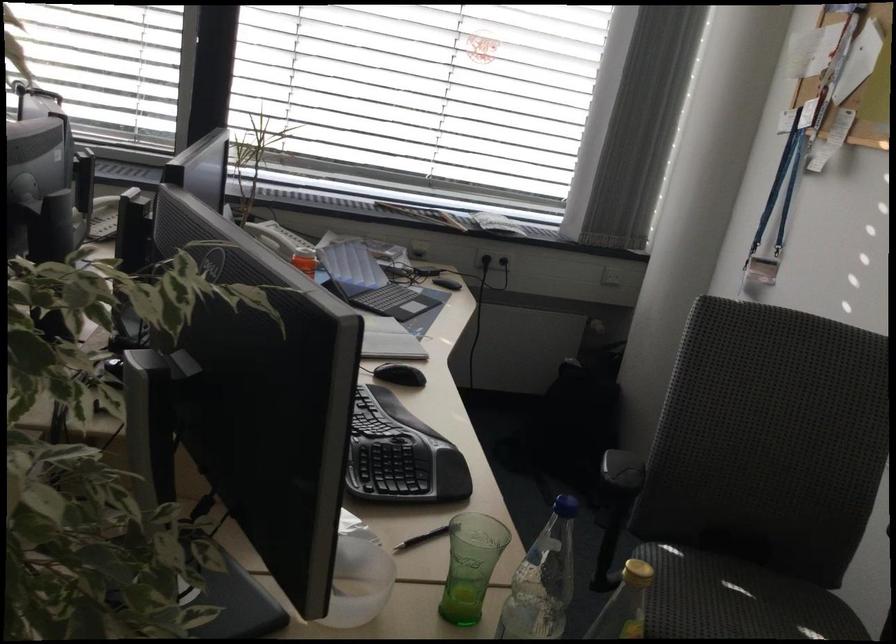
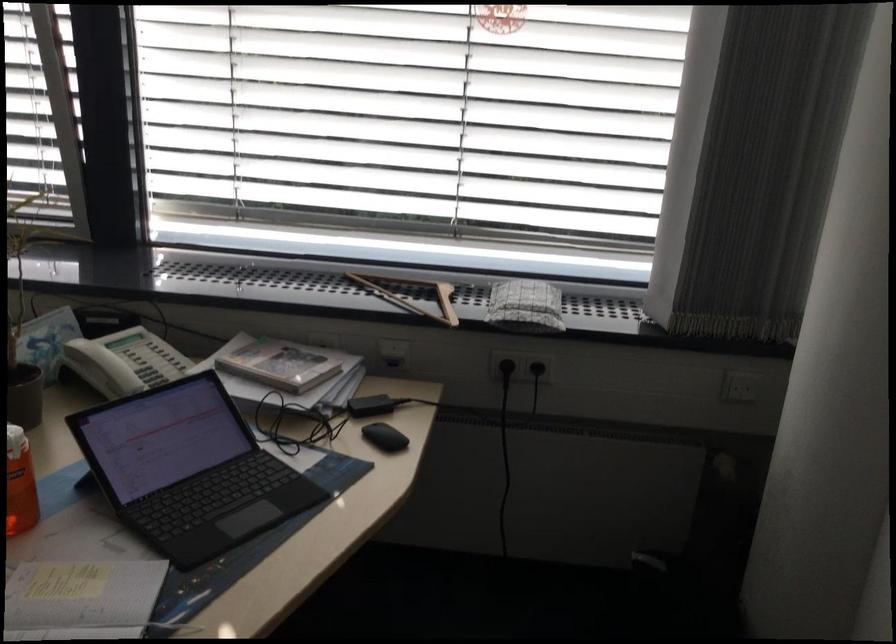
What movement of the cameraman would produce the second image?

The movement direction of the cameraman is right, forward.